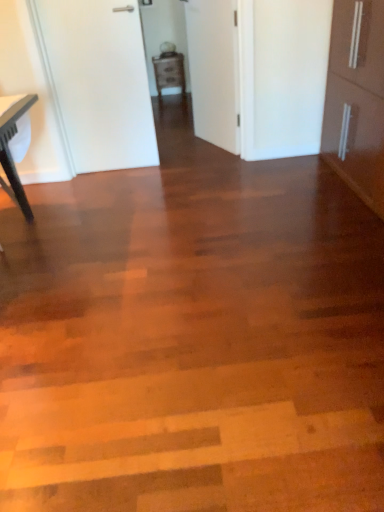
Question: Are matte black table at left and matte brown cabinet at center far apart?

Choices:
 (A) no
 (B) yes

Answer: (B)

Question: Is matte black table at left shorter than matte brown cabinet at center?

Choices:
 (A) yes
 (B) no

Answer: (B)

Question: From a real-world perspective, is matte black table at left positioned over matte brown cabinet at center based on gravity?

Choices:
 (A) yes
 (B) no

Answer: (A)

Question: Is matte black table at left beside matte brown cabinet at center?

Choices:
 (A) no
 (B) yes

Answer: (A)

Question: Is matte black table at left bigger than matte brown cabinet at center?

Choices:
 (A) no
 (B) yes

Answer: (B)

Question: From the image's perspective, is matte black table at left below matte brown cabinet at center?

Choices:
 (A) yes
 (B) no

Answer: (A)

Question: Does matte black table at left have a greater width compared to white matte door at center, which ranks as the 2th door in left-to-right order?

Choices:
 (A) no
 (B) yes

Answer: (B)

Question: Is matte black table at left not close to white matte door at center, which is the first door from right to left?

Choices:
 (A) yes
 (B) no

Answer: (A)

Question: From a real-world perspective, is matte black table at left under white matte door at center, which ranks as the 2th door in left-to-right order?

Choices:
 (A) no
 (B) yes

Answer: (B)

Question: Can you confirm if matte black table at left is bigger than white matte door at center, which ranks as the 2th door in left-to-right order?

Choices:
 (A) yes
 (B) no

Answer: (A)

Question: From the image's perspective, is matte black table at left beneath white matte door at center, which is the first door from right to left?

Choices:
 (A) no
 (B) yes

Answer: (B)

Question: Is white matte door at center, which ranks as the 2th door in left-to-right order, surrounded by matte black table at left?

Choices:
 (A) yes
 (B) no

Answer: (B)

Question: Is white matte door at upper left, the 1th door from the left, positioned beyond the bounds of matte brown cabinet at center?

Choices:
 (A) no
 (B) yes

Answer: (B)